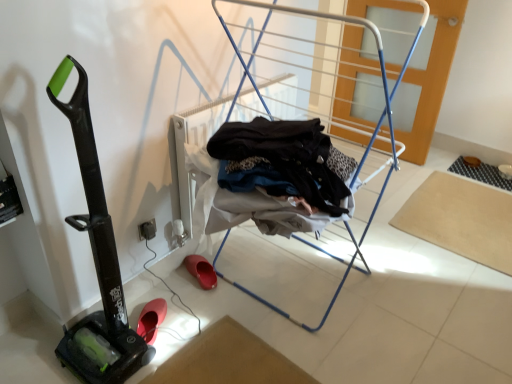
Find the location of `free space that is to the left of black rubber vacuum at left`. free space that is to the left of black rubber vacuum at left is located at coordinates (35, 352).